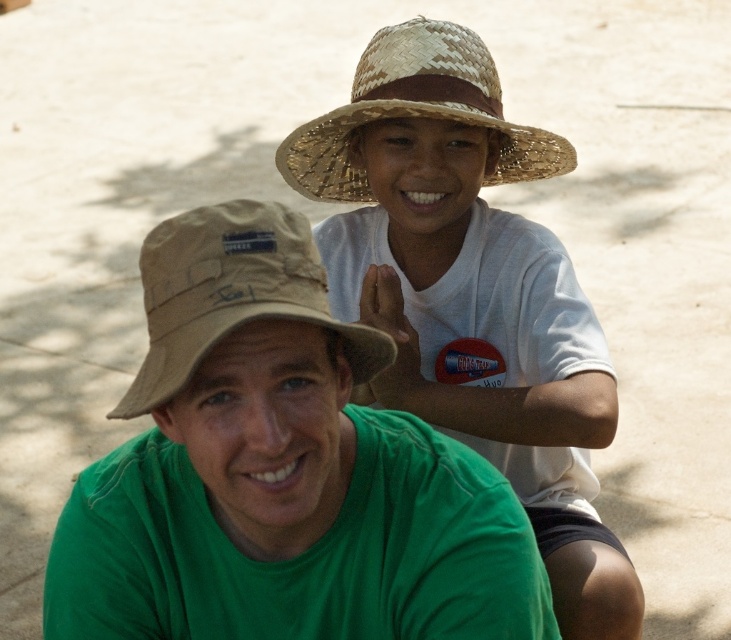
You are trying to decide which item to pack for a trip. You have a limited space in your bag. Based on the image, which item, the green cotton shirt at center or the natural straw hat at upper center, is wider and would take up more room?

The green cotton shirt at center is wider than the natural straw hat at upper center, so it would take up more room in the bag.

You are standing at the origin point of the image. Which direction should you move to reach the green cotton shirt at center?

The green cotton shirt at center is located at coordinates point (279, 472), so you should move towards the right and slightly upwards from the origin point to reach it.